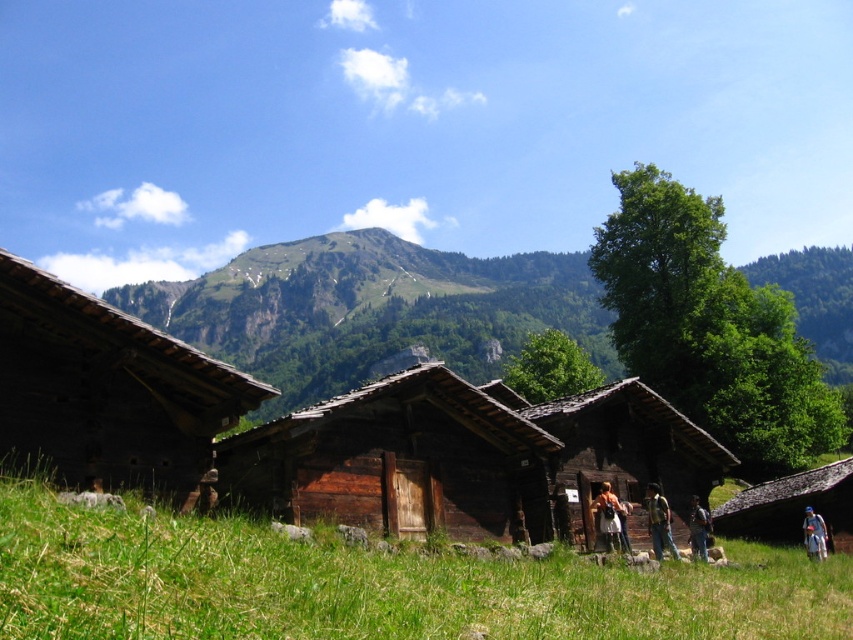
Question: Does green grassy at lower center appear on the right side of camouflage fabric shirt at lower right?

Choices:
 (A) no
 (B) yes

Answer: (A)

Question: Which of these objects is positioned closest to the brown leather jacket at center?

Choices:
 (A) brown wooden cabin at left
 (B) brown wooden hut at center
 (C) camouflage fabric shirt at lower right
 (D) wooden cabin at lower right

Answer: (C)

Question: Which object appears farthest from the camera in this image?

Choices:
 (A) camouflage fabric shirt at lower right
 (B) brown leather jacket at center

Answer: (A)

Question: Is brown wooden hut at center to the left of blue denim shorts at lower right from the viewer's perspective?

Choices:
 (A) yes
 (B) no

Answer: (A)

Question: Which point is farther to the camera?

Choices:
 (A) (699, 513)
 (B) (792, 484)
 (C) (595, 525)
 (D) (247, 593)

Answer: (B)

Question: Does wooden cabin at lower right have a lesser width compared to camouflage fabric shirt at lower right?

Choices:
 (A) no
 (B) yes

Answer: (A)